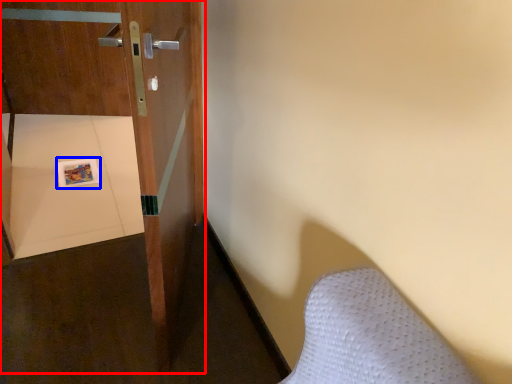
Question: Which point is further to the camera, door (highlighted by a red box) or copy (highlighted by a blue box)?

Choices:
 (A) door
 (B) copy

Answer: (B)